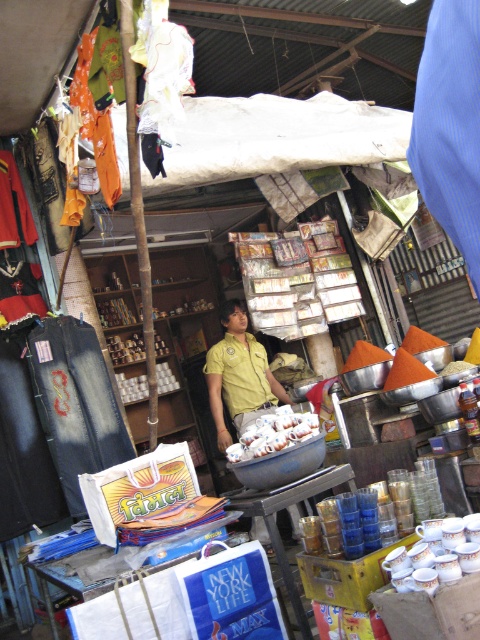
Question: Which object appears closest to the camera in this image?

Choices:
 (A) white matte eggs at center
 (B) yellow uniform at center

Answer: (A)

Question: Is yellow uniform at center wider than white matte eggs at center?

Choices:
 (A) no
 (B) yes

Answer: (B)

Question: Is the position of yellow uniform at center less distant than that of white matte eggs at center?

Choices:
 (A) no
 (B) yes

Answer: (A)

Question: Does yellow uniform at center appear under white matte eggs at center?

Choices:
 (A) no
 (B) yes

Answer: (A)